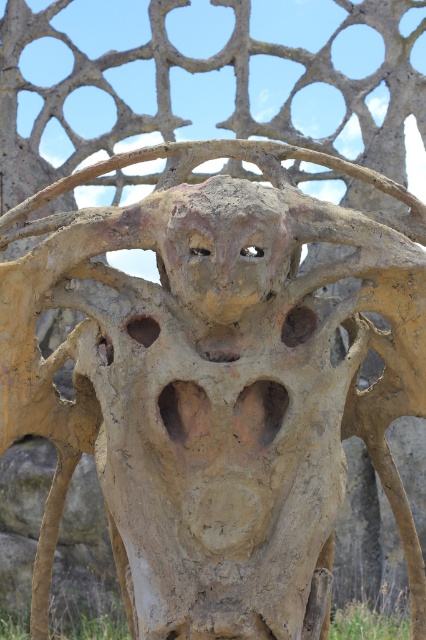
Find the location of `rusty clay face at center`. rusty clay face at center is located at coordinates (222, 246).

Between rusty clay face at center and green grass at lower center, which one has more height?

With more height is rusty clay face at center.

What do you see at coordinates (222, 246) in the screenshot?
I see `rusty clay face at center` at bounding box center [222, 246].

Locate an element on the screen. The width and height of the screenshot is (426, 640). rusty clay face at center is located at coordinates (222, 246).